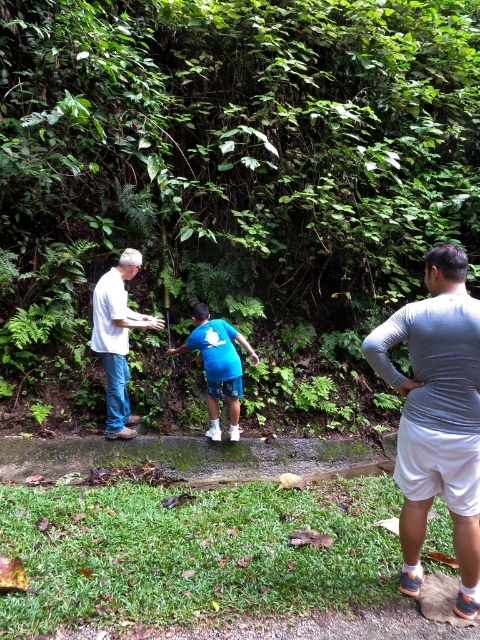
Between point (112, 429) and point (240, 392), which one is positioned in front?

Point (112, 429)

Can you confirm if white matte shirt at left is positioned to the right of blue cotton shirt at center?

Incorrect, white matte shirt at left is not on the right side of blue cotton shirt at center.

Locate an element on the screen. Image resolution: width=480 pixels, height=640 pixels. white matte shirt at left is located at coordinates (117, 339).

In order to click on white matte shirt at left in this screenshot , I will do `click(117, 339)`.

Does gray long-sleeved shirt at right have a lesser height compared to blue cotton shirt at center?

In fact, gray long-sleeved shirt at right may be taller than blue cotton shirt at center.

Who is more forward, [450,294] or [213,412]?

Positioned in front is point [450,294].

Image resolution: width=480 pixels, height=640 pixels. I want to click on gray long-sleeved shirt at right, so click(437, 417).

Which is more to the left, gray long-sleeved shirt at right or white matte shirt at left?

white matte shirt at left is more to the left.

Can you confirm if gray long-sleeved shirt at right is taller than white matte shirt at left?

Indeed, gray long-sleeved shirt at right has a greater height compared to white matte shirt at left.

Which is in front, point (430, 484) or point (104, 358)?

Point (430, 484)

At what (x,y) coordinates should I click in order to perform the action: click on gray long-sleeved shirt at right. Please return your answer as a coordinate pair (x, y). The width and height of the screenshot is (480, 640). Looking at the image, I should click on (437, 417).